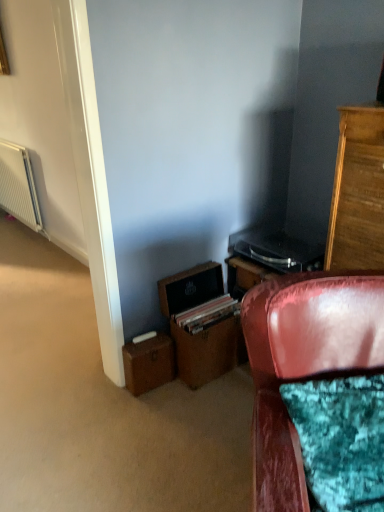
Question: From a real-world perspective, relative to brown cardboard drawer at lower center, is brown leather file cabinet at lower center vertically above or below?

Choices:
 (A) above
 (B) below

Answer: (A)

Question: From the image's perspective, is brown leather file cabinet at lower center above or below brown cardboard drawer at lower center?

Choices:
 (A) above
 (B) below

Answer: (A)

Question: Estimate the real-world distances between objects in this image. Which object is closer to the brown cardboard box at lower left?

Choices:
 (A) velvet red chair at lower right
 (B) white textured radiator at left
 (C) brown leather file cabinet at lower center
 (D) brown cardboard drawer at lower center
 (E) wooden cabinet at right

Answer: (D)

Question: Which object is the farthest from the white textured radiator at left?

Choices:
 (A) brown cardboard drawer at lower center
 (B) brown cardboard box at lower left
 (C) wooden cabinet at right
 (D) velvet red chair at lower right
 (E) brown leather file cabinet at lower center

Answer: (D)